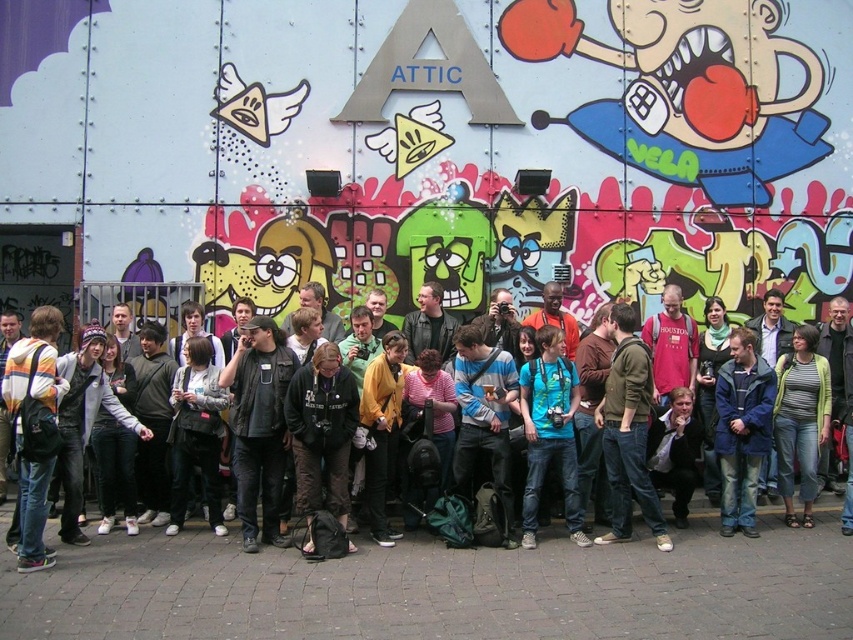
Who is positioned more to the right, blue fabric jacket at center or dark gray jacket at center?

blue fabric jacket at center

Is point (747, 348) positioned in front of point (387, 378)?

That is False.

Locate an element on the screen. The height and width of the screenshot is (640, 853). blue fabric jacket at center is located at coordinates (741, 429).